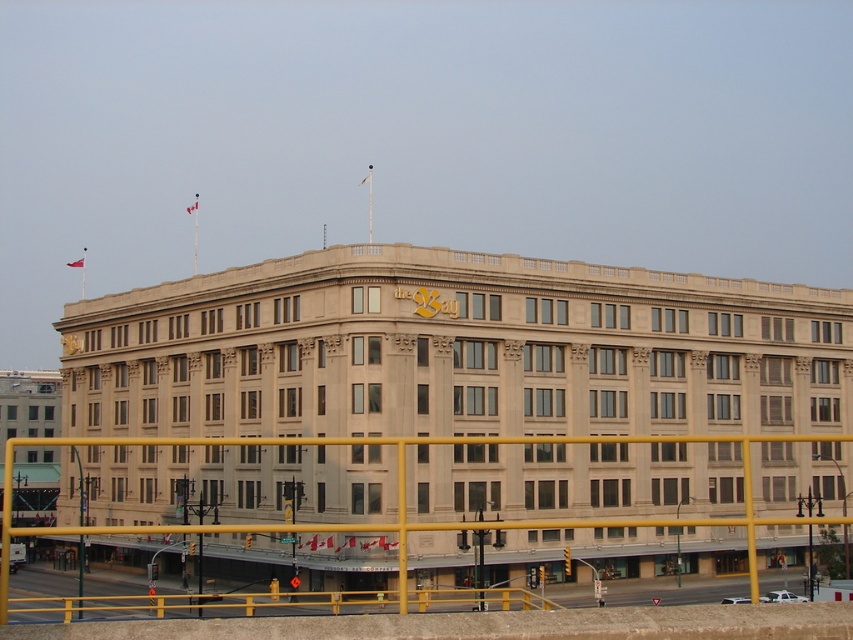
Question: Which point is closer to the camera?

Choices:
 (A) (80, 602)
 (B) (68, 349)

Answer: (A)

Question: Which point is closer to the camera taking this photo?

Choices:
 (A) (80, 568)
 (B) (73, 344)

Answer: (A)

Question: Is yellow metallic pole at lower left to the right of gold metallic clock at upper center from the viewer's perspective?

Choices:
 (A) no
 (B) yes

Answer: (B)

Question: Which object is farther from the camera taking this photo?

Choices:
 (A) gold metallic clock at upper center
 (B) yellow metallic pole at lower left

Answer: (A)

Question: Is the position of yellow metallic pole at lower left less distant than that of gold metallic clock at upper center?

Choices:
 (A) yes
 (B) no

Answer: (A)

Question: Does yellow metallic pole at lower left have a larger size compared to gold metallic clock at upper center?

Choices:
 (A) no
 (B) yes

Answer: (B)